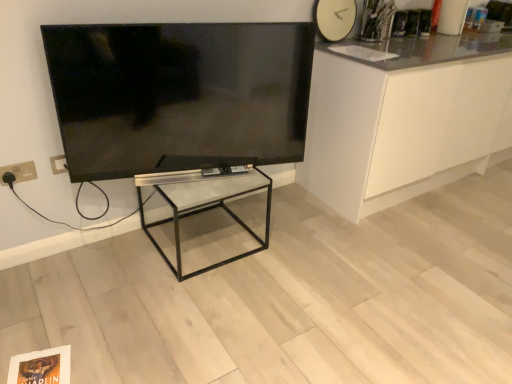
Locate an element on the screen. This screenshot has width=512, height=384. vacant area located to the right-hand side of white matte clock at upper right is located at coordinates (370, 48).